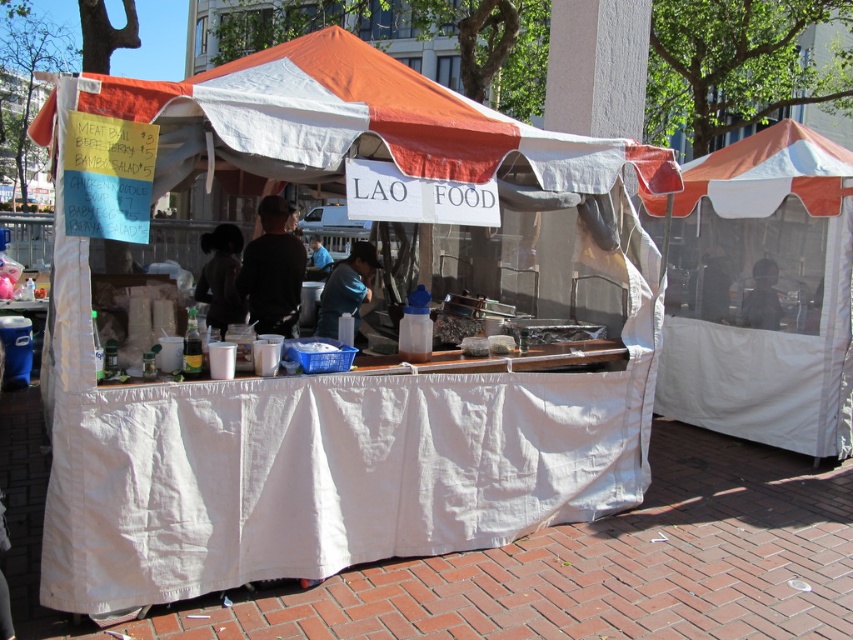
You are a customer at the Lao food stall and want to place an order. The counter has two points marked as point (664, 204) and point (326, 298). If you are facing the counter, which point is closer to you?

Point (326, 298) is closer to you because it is in front of point (664, 204).

You are a customer at the food stall and want to order from the person behind the counter. Which object is closer to you if you are standing in front of the stall? The white canvas tent at right or the blue fabric shirt at center?

The blue fabric shirt at center is closer to you because the white canvas tent at right is positioned to its right, meaning the shirt is nearer to the front of the stall.

You are a customer standing outside the LAO FOOD stall. You notice the white canvas tent at center and the dark hair at center. Which object is positioned higher from the ground?

The white canvas tent at center is positioned higher from the ground than the dark hair at center.